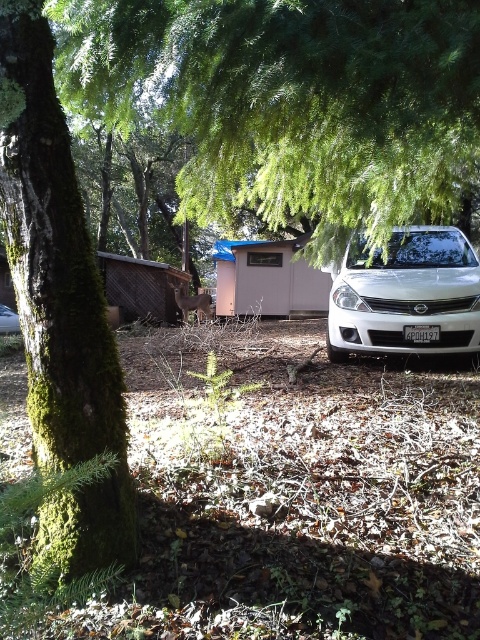
Question: Estimate the real-world distances between objects in this image. Which object is farther from the white matte shed at center?

Choices:
 (A) green mossy bark tree at left
 (B) white matte sedan at center

Answer: (A)

Question: Which of the following is the closest to the observer?

Choices:
 (A) green mossy tree at left
 (B) metallic silver car at center

Answer: (A)

Question: Is green mossy tree at left positioned in front of white matte sedan at center?

Choices:
 (A) no
 (B) yes

Answer: (B)

Question: Which object appears farthest from the camera in this image?

Choices:
 (A) metallic silver car at center
 (B) green mossy tree at left
 (C) green mossy bark tree at left

Answer: (A)

Question: Can you confirm if green mossy tree at left is positioned above white matte shed at center?

Choices:
 (A) no
 (B) yes

Answer: (A)

Question: Does white matte sedan at center appear on the right side of white matte shed at center?

Choices:
 (A) yes
 (B) no

Answer: (A)